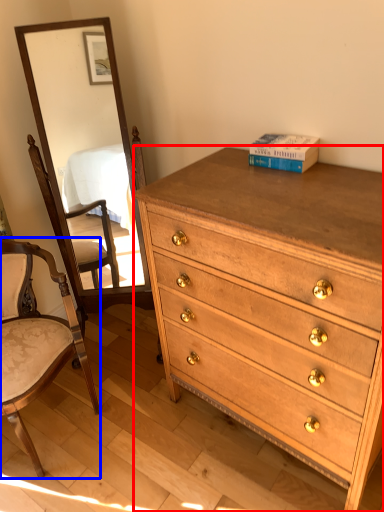
Question: Among these objects, which one is farthest to the camera, chest of drawers (highlighted by a red box) or chair (highlighted by a blue box)?

Choices:
 (A) chest of drawers
 (B) chair

Answer: (B)